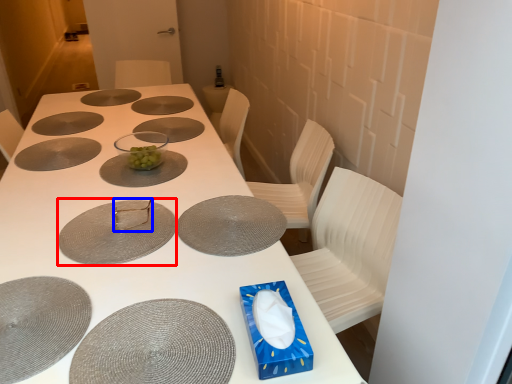
Question: Which point is further to the camera, glass plate (highlighted by a red box) or tableware (highlighted by a blue box)?

Choices:
 (A) glass plate
 (B) tableware

Answer: (B)